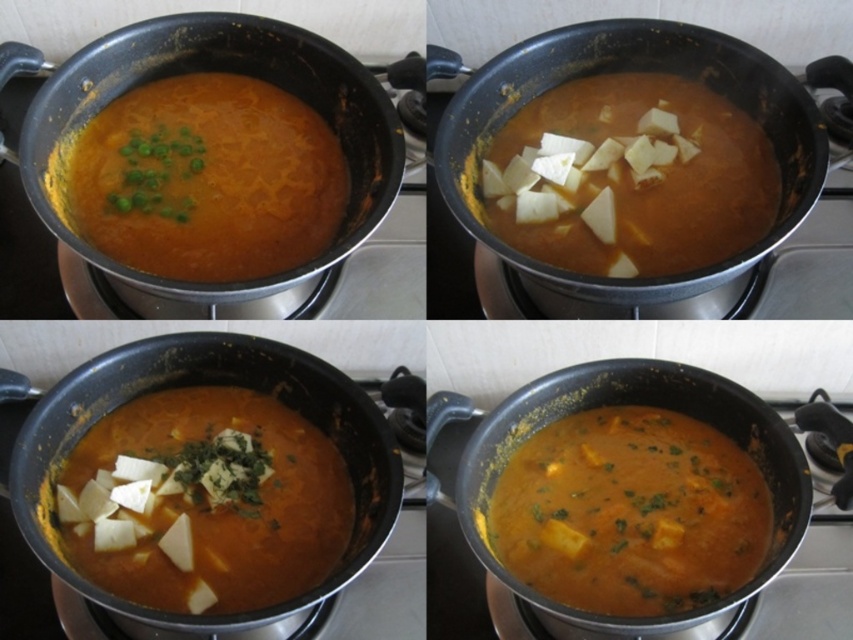
Question: Does white crumbly tofu at center have a lesser width compared to white creamy cubes at center?

Choices:
 (A) no
 (B) yes

Answer: (B)

Question: In this image, where is matte orange soup at upper left located relative to white creamy cubes at center?

Choices:
 (A) left
 (B) right

Answer: (A)

Question: Estimate the real-world distances between objects in this image. Which object is farther from the orange matte curry at center?

Choices:
 (A) matte orange soup at upper left
 (B) white crumbly tofu at center
 (C) white creamy cubes at center

Answer: (A)

Question: Which object is the farthest from the white crumbly tofu at center?

Choices:
 (A) white creamy cubes at center
 (B) matte orange soup at upper left
 (C) orange matte curry at center

Answer: (A)

Question: Observing the image, what is the correct spatial positioning of orange matte curry at center in reference to white creamy cubes at center?

Choices:
 (A) left
 (B) right

Answer: (A)

Question: Which point is closer to the camera?

Choices:
 (A) (566, 577)
 (B) (67, 545)
 (C) (322, 182)

Answer: (A)